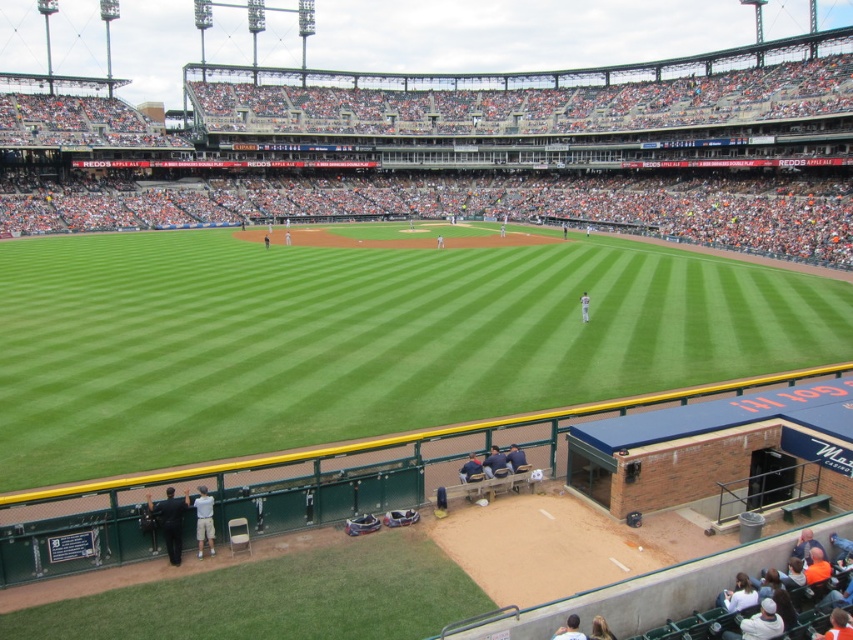
You are a drone operator trying to capture a live baseball game. Your drone is currently hovering above the dugout with a blue roof. To get a clear shot of the green grass field at center, in which direction should you move the drone?

The green grass field at center is located at point [358,340], so you should move the drone towards the center of the image to capture the green grass field at center.